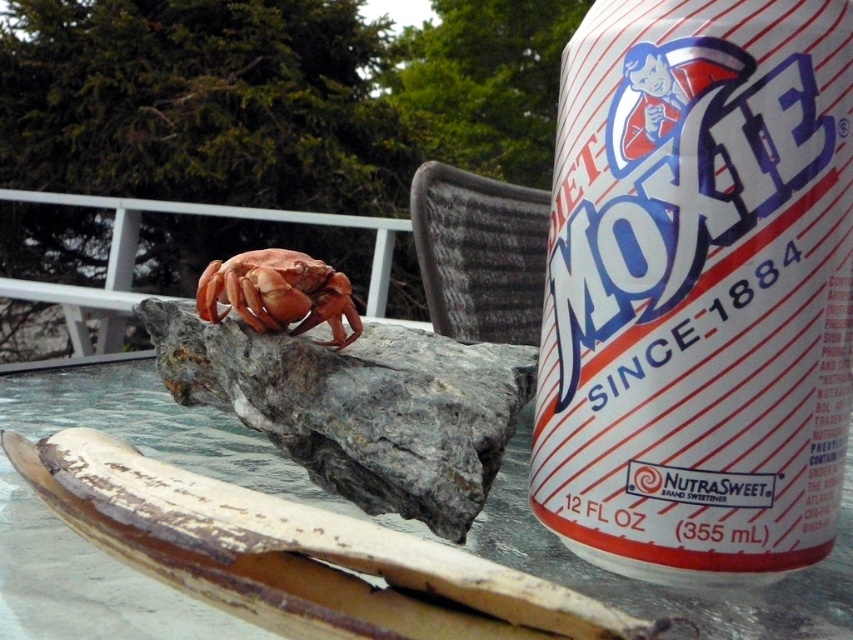
Question: Observing the image, what is the correct spatial positioning of white paper can at upper right in reference to smooth orange crab at center?

Choices:
 (A) above
 (B) below

Answer: (B)

Question: Is white paper can at upper right behind smooth orange crab at center?

Choices:
 (A) yes
 (B) no

Answer: (B)

Question: Is the position of white paper can at upper right less distant than that of smooth orange crab at center?

Choices:
 (A) no
 (B) yes

Answer: (B)

Question: Which point appears farthest from the camera in this image?

Choices:
 (A) (659, 76)
 (B) (320, 298)

Answer: (B)

Question: Which point appears farthest from the camera in this image?

Choices:
 (A) (268, 301)
 (B) (596, 499)

Answer: (A)

Question: Which object is farther from the camera taking this photo?

Choices:
 (A) white paper can at upper right
 (B) smooth orange crab at center

Answer: (B)